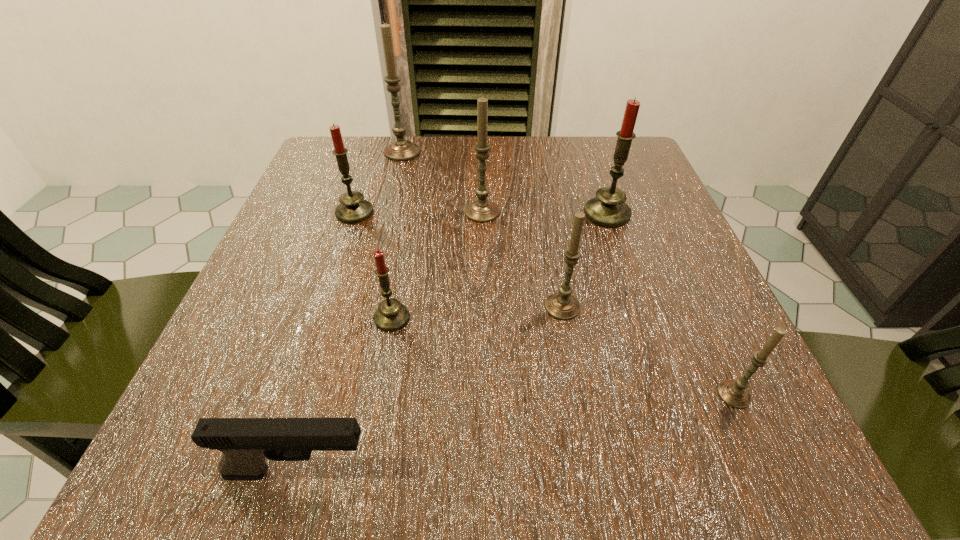
At what (x,y) coordinates should I click in order to perform the action: click on the second closest gray candle to the second red candle from left to right. Please return your answer as a coordinate pair (x, y). Looking at the image, I should click on (481, 210).

Image resolution: width=960 pixels, height=540 pixels. Identify the location of gray candle that stands as the third closest to the farthest gray candle. (734, 393).

Select which red candle appears as the closest to the leftmost red candle. Please provide its 2D coordinates. Your answer should be formatted as a tuple, i.e. [(x, y)], where the tuple contains the x and y coordinates of a point satisfying the conditions above.

[(391, 315)]

What are the coordinates of `red candle that is the nearest to the third candle from right to left` in the screenshot? It's located at (608, 209).

Identify the location of vacant space that satisfies the following two spatial constraints: 1. on the front side of the rightmost object; 2. on the right side of the second red candle from left to right. (378, 394).